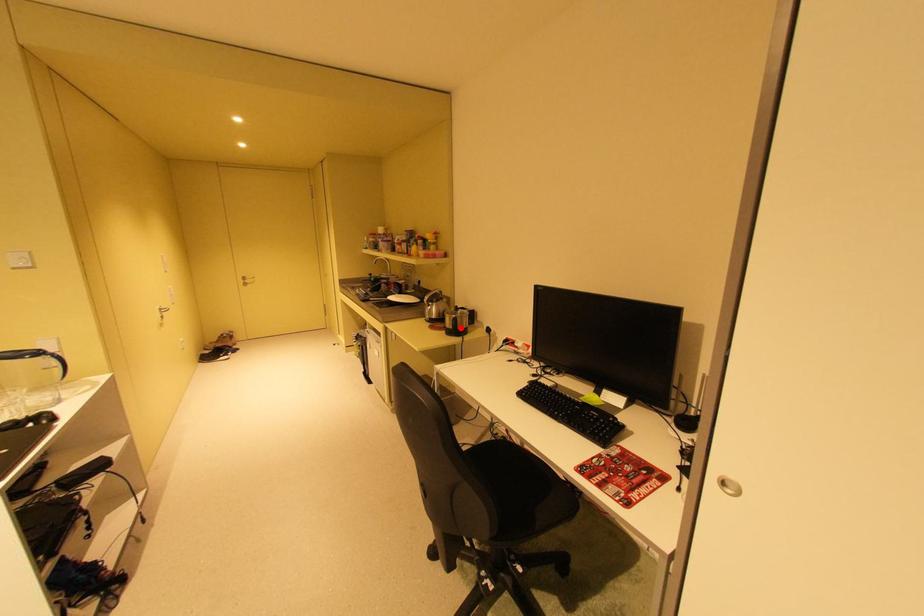
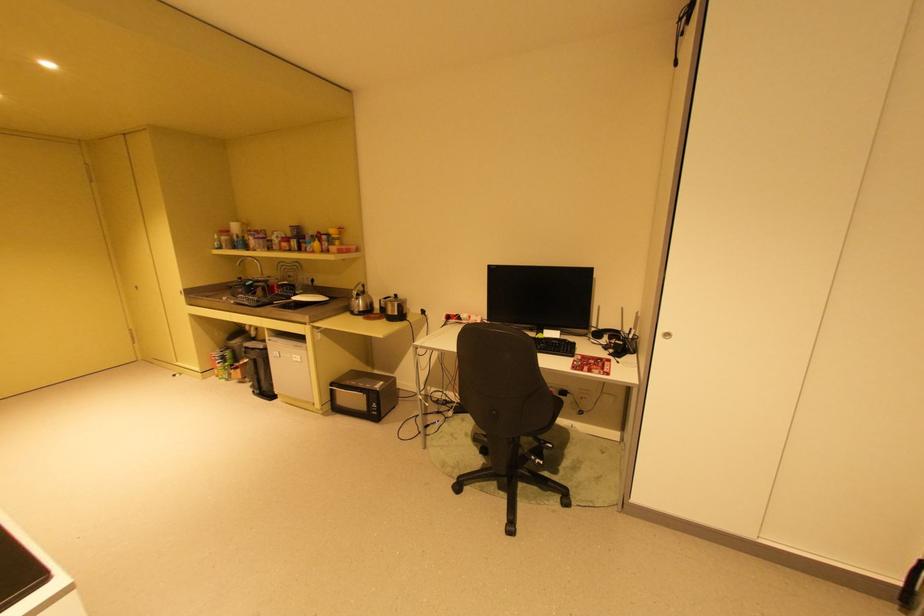
Question: A red point is marked in image1. In image2, is the corresponding 3D point closer to the camera or farther? Reply with the corresponding letter.

Choices:
 (A) The corresponding 3D point is closer.
 (B) The corresponding 3D point is farther.

Answer: (A)